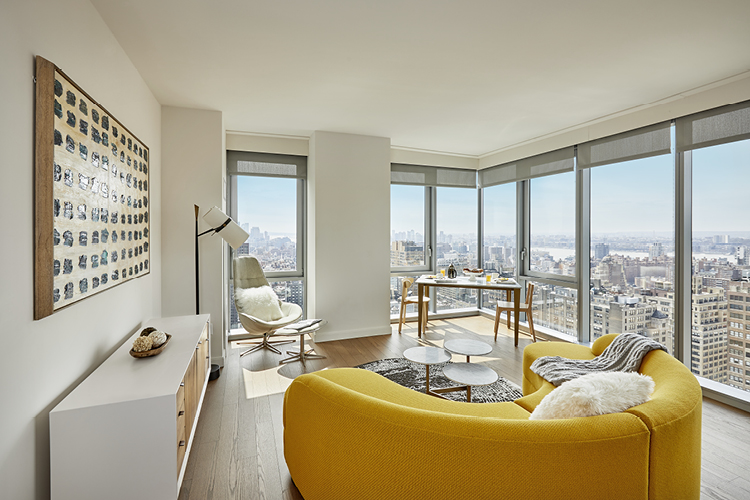
Where is `windows`? The height and width of the screenshot is (500, 750). windows is located at coordinates (708, 210), (624, 237), (549, 233), (490, 225), (452, 230), (412, 221), (266, 216).